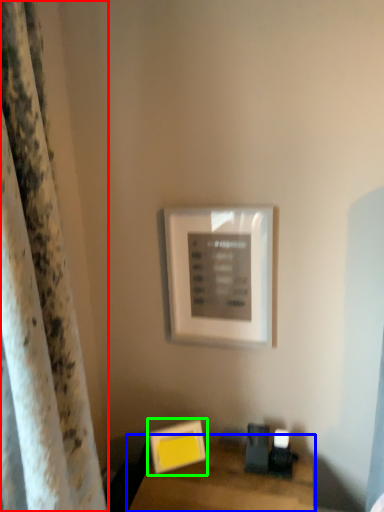
Question: Which is farther away from curtain (highlighted by a red box)? table (highlighted by a blue box) or picture frame (highlighted by a green box)?

Choices:
 (A) table
 (B) picture frame

Answer: (B)